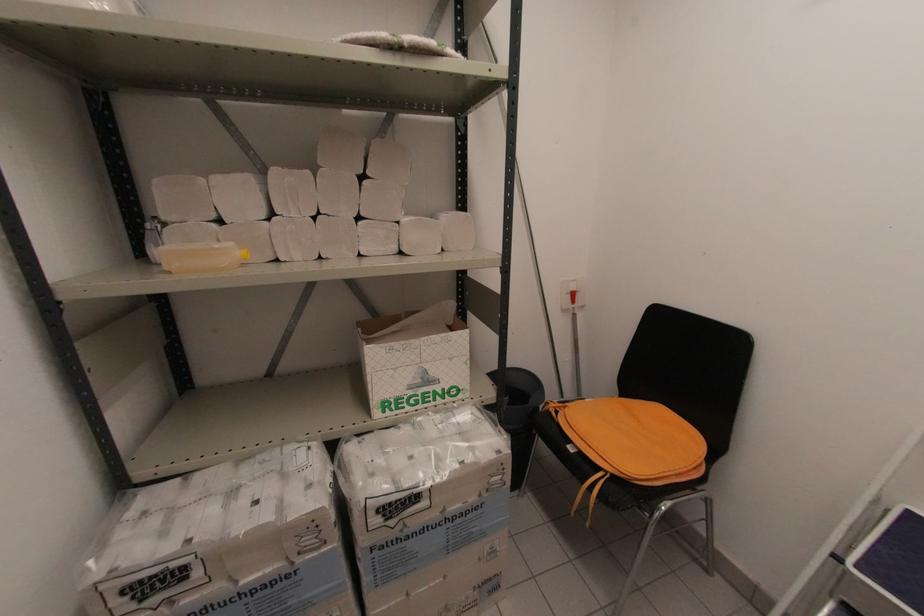
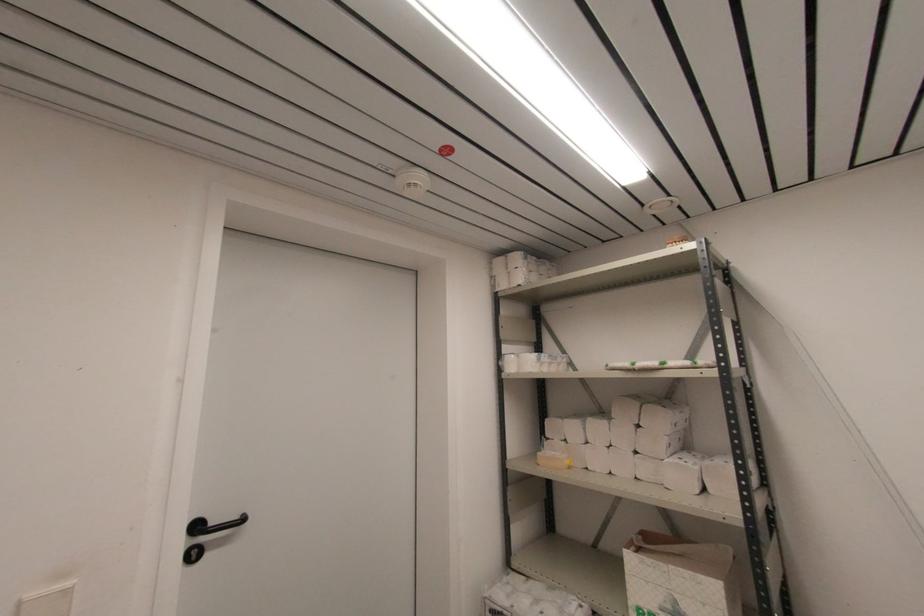
In the second image, find the point that corresponds to the point at 165,217 in the first image.

(548, 436)